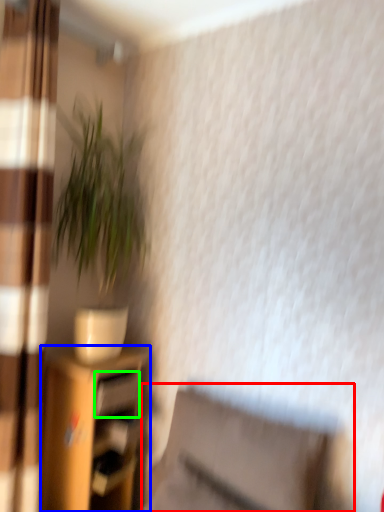
Question: Which object is positioned farthest from swivel chair (highlighted by a red box)? Select from shelf (highlighted by a blue box) and drawer (highlighted by a green box).

Choices:
 (A) shelf
 (B) drawer

Answer: (B)